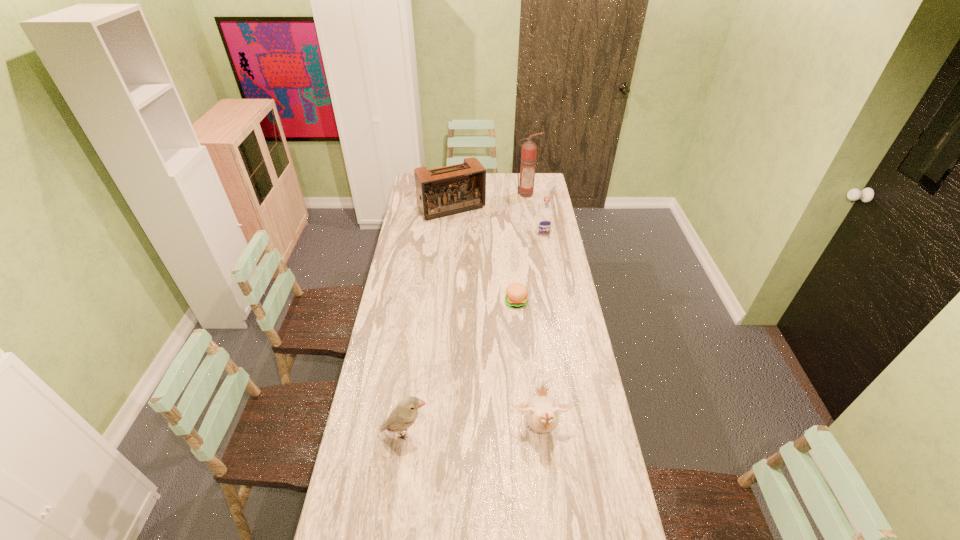
The image size is (960, 540). In order to click on vacant space located 0.130m at the face of the left bird in this screenshot , I will do `click(468, 433)`.

Identify the location of vacant area situated at the beak of the right bird. (551, 522).

At what (x,y) coordinates should I click in order to perform the action: click on vacant area situated 0.260m on the left of the hamburger. Please return your answer as a coordinate pair (x, y). Looking at the image, I should click on (447, 302).

Where is `object that is at the far edge`? The height and width of the screenshot is (540, 960). object that is at the far edge is located at coordinates (529, 149).

Identify the location of radio receiver that is positioned at the left edge. (440, 192).

Find the location of a particular element. The width and height of the screenshot is (960, 540). bird that is at the left edge is located at coordinates (404, 415).

I want to click on fire extinguisher located in the right edge section of the desktop, so click(529, 149).

Locate an element on the screen. vodka that is at the right edge is located at coordinates (544, 219).

At what (x,y) coordinates should I click in order to perform the action: click on bird that is at the right edge. Please return your answer as a coordinate pair (x, y). Looking at the image, I should click on (541, 412).

Find the location of a particular element. object that is at the far right corner is located at coordinates (529, 149).